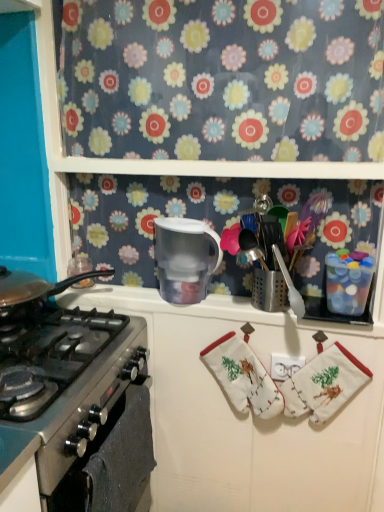
Question: Should I look upward or downward to see white cotton oven mitts at lower right?

Choices:
 (A) up
 (B) down

Answer: (B)

Question: Is floral fabric at upper center oriented away from stainless steel oven at lower left?

Choices:
 (A) yes
 (B) no

Answer: (B)

Question: Can you confirm if floral fabric at upper center is taller than stainless steel oven at lower left?

Choices:
 (A) yes
 (B) no

Answer: (A)

Question: Is floral fabric at upper center not near stainless steel oven at lower left?

Choices:
 (A) yes
 (B) no

Answer: (B)

Question: Does floral fabric at upper center have a lesser height compared to stainless steel oven at lower left?

Choices:
 (A) yes
 (B) no

Answer: (B)

Question: Is floral fabric at upper center in front of stainless steel oven at lower left?

Choices:
 (A) no
 (B) yes

Answer: (A)

Question: Can you confirm if floral fabric at upper center is thinner than stainless steel oven at lower left?

Choices:
 (A) no
 (B) yes

Answer: (A)

Question: Is stainless steel gas stove at left bigger than stainless steel oven at lower left?

Choices:
 (A) yes
 (B) no

Answer: (A)

Question: Is stainless steel gas stove at left outside stainless steel oven at lower left?

Choices:
 (A) yes
 (B) no

Answer: (A)

Question: From the image's perspective, is stainless steel gas stove at left located above stainless steel oven at lower left?

Choices:
 (A) yes
 (B) no

Answer: (A)

Question: From a real-world perspective, does stainless steel gas stove at left sit lower than stainless steel oven at lower left?

Choices:
 (A) no
 (B) yes

Answer: (A)

Question: Is stainless steel gas stove at left turned away from stainless steel oven at lower left?

Choices:
 (A) no
 (B) yes

Answer: (A)

Question: From the image's perspective, is stainless steel gas stove at left under stainless steel oven at lower left?

Choices:
 (A) no
 (B) yes

Answer: (A)

Question: Is transparent plastic pitcher at center not within white plastic outlet at center?

Choices:
 (A) no
 (B) yes

Answer: (B)